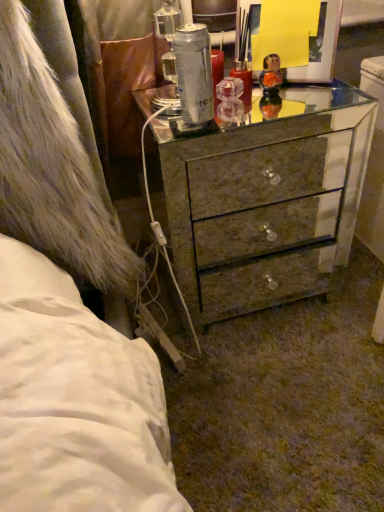
Question: Do you think metallic mirrored chest of drawers at center is within translucent glass figurine at upper center, or outside of it?

Choices:
 (A) inside
 (B) outside

Answer: (B)

Question: Relative to translucent glass figurine at upper center, is metallic mirrored chest of drawers at center in front or behind?

Choices:
 (A) front
 (B) behind

Answer: (A)

Question: Looking at the image, does metallic mirrored chest of drawers at center seem bigger or smaller compared to translucent glass figurine at upper center?

Choices:
 (A) small
 (B) big

Answer: (B)

Question: Considering their positions, is translucent glass figurine at upper center located in front of or behind metallic mirrored chest of drawers at center?

Choices:
 (A) behind
 (B) front

Answer: (A)

Question: Looking at their shapes, would you say translucent glass figurine at upper center is wider or thinner than metallic mirrored chest of drawers at center?

Choices:
 (A) thin
 (B) wide

Answer: (A)

Question: In the image, is translucent glass figurine at upper center on the left side or the right side of metallic mirrored chest of drawers at center?

Choices:
 (A) right
 (B) left

Answer: (A)

Question: From the image's perspective, is translucent glass figurine at upper center located above or below metallic mirrored chest of drawers at center?

Choices:
 (A) above
 (B) below

Answer: (A)